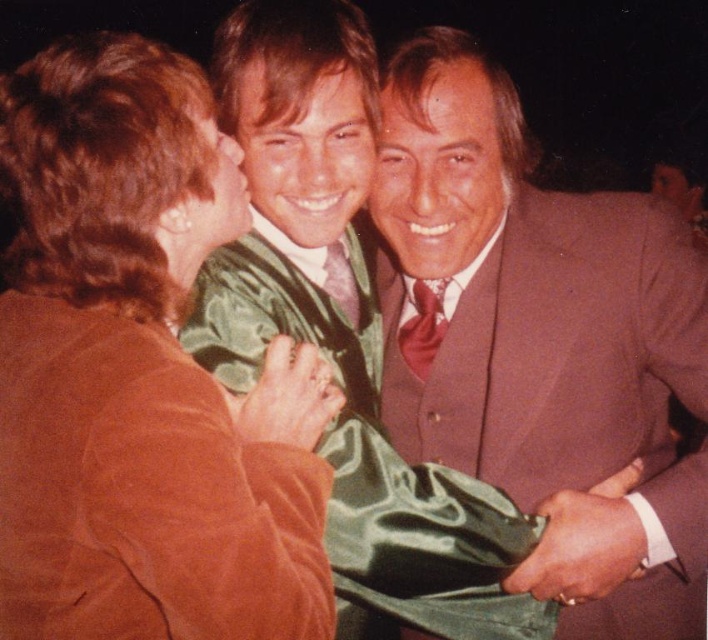
Question: Is matte brown suit at center bigger than maroon satin tie at center?

Choices:
 (A) yes
 (B) no

Answer: (A)

Question: Is matte brown suit at center behind satin green dress at center?

Choices:
 (A) no
 (B) yes

Answer: (B)

Question: Is brown suede jacket at upper left thinner than maroon satin tie at center?

Choices:
 (A) yes
 (B) no

Answer: (B)

Question: Which of the following is the farthest from the observer?

Choices:
 (A) matte brown suit at center
 (B) satin green dress at center
 (C) satin red tie at center
 (D) maroon satin tie at center

Answer: (C)

Question: Which point appears farthest from the camera in this image?

Choices:
 (A) (542, 614)
 (B) (486, 445)
 (C) (435, 296)
 (D) (358, 330)

Answer: (C)

Question: Which point appears closest to the camera in this image?

Choices:
 (A) (394, 609)
 (B) (629, 552)

Answer: (A)